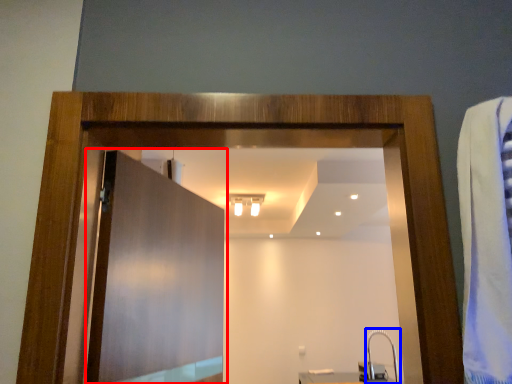
Question: Which of the following is the farthest to the observer, door (highlighted by a red box) or faucet (highlighted by a blue box)?

Choices:
 (A) door
 (B) faucet

Answer: (B)